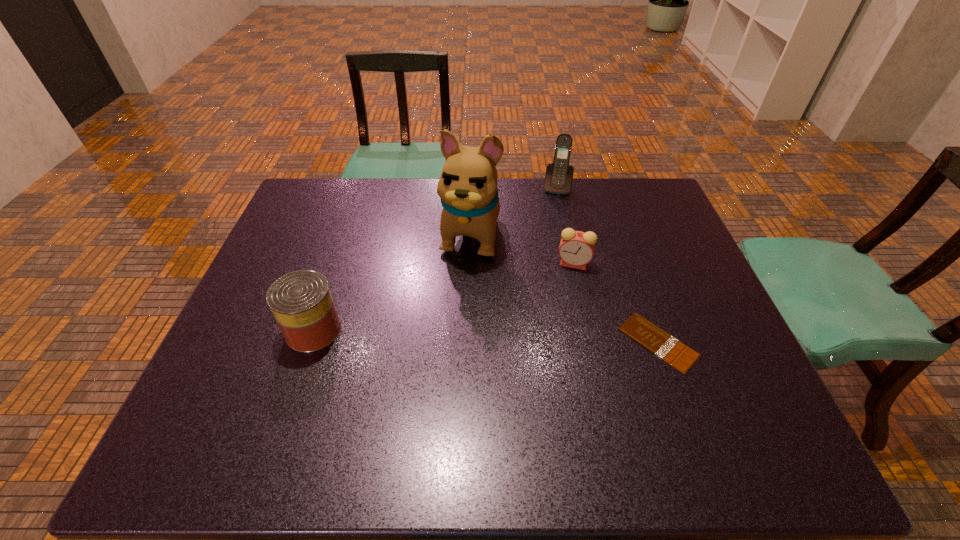
This screenshot has height=540, width=960. In order to click on object that is the fourth closest to the second object from left to right in this screenshot , I will do `click(656, 340)`.

Locate an element on the screen. free space that satisfies the following two spatial constraints: 1. on the back side of the second object from left to right; 2. on the left side of the farthest object is located at coordinates (471, 187).

Locate an element on the screen. This screenshot has width=960, height=540. vacant space that satisfies the following two spatial constraints: 1. on the back side of the second tallest object; 2. on the right side of the puppy is located at coordinates pos(471,187).

Where is `vacant space that satisfies the following two spatial constraints: 1. on the front side of the fourth shortest object; 2. on the left side of the alarm clock`? The image size is (960, 540). vacant space that satisfies the following two spatial constraints: 1. on the front side of the fourth shortest object; 2. on the left side of the alarm clock is located at coordinates (573, 264).

Find the location of a particular element. This screenshot has height=540, width=960. vacant region that satisfies the following two spatial constraints: 1. on the back side of the fourth shortest object; 2. on the right side of the can is located at coordinates (362, 187).